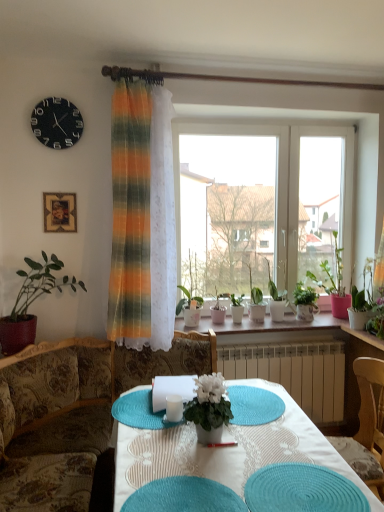
Question: Can you confirm if teal woven placemat at center is thinner than wooden chair at right, the first chair when ordered from right to left?

Choices:
 (A) no
 (B) yes

Answer: (B)

Question: From a real-world perspective, does teal woven placemat at center sit lower than wooden chair at right, the 1th chair in the back-to-front sequence?

Choices:
 (A) no
 (B) yes

Answer: (A)

Question: From the image's perspective, would you say teal woven placemat at center is positioned over wooden chair at right, the first chair when ordered from right to left?

Choices:
 (A) no
 (B) yes

Answer: (B)

Question: Is wooden chair at right, the 1th chair in the back-to-front sequence, a part of teal woven placemat at center?

Choices:
 (A) yes
 (B) no

Answer: (B)

Question: Is teal woven placemat at center closer to the viewer compared to wooden chair at right, the 1th chair in the back-to-front sequence?

Choices:
 (A) no
 (B) yes

Answer: (B)

Question: From a real-world perspective, is teal woven placemat at center located higher than wooden chair at right, the 1th chair in the back-to-front sequence?

Choices:
 (A) no
 (B) yes

Answer: (B)

Question: Is green glossy plant at right smaller than teal fabric placemat at lower center?

Choices:
 (A) yes
 (B) no

Answer: (B)

Question: Considering the relative positions of green glossy plant at right and teal fabric placemat at lower center in the image provided, is green glossy plant at right to the right of teal fabric placemat at lower center from the viewer's perspective?

Choices:
 (A) yes
 (B) no

Answer: (A)

Question: Does green glossy plant at right have a larger size compared to teal fabric placemat at lower center?

Choices:
 (A) yes
 (B) no

Answer: (A)

Question: From a real-world perspective, is green glossy plant at right on teal fabric placemat at lower center?

Choices:
 (A) yes
 (B) no

Answer: (A)

Question: Does green glossy plant at right have a lesser width compared to teal fabric placemat at lower center?

Choices:
 (A) yes
 (B) no

Answer: (A)

Question: Is green glossy plant at right in front of teal fabric placemat at lower center?

Choices:
 (A) yes
 (B) no

Answer: (B)

Question: Is teal fabric placemat at lower center behind green matte plant at left, which ranks as the 1th houseplant in left-to-right order?

Choices:
 (A) yes
 (B) no

Answer: (B)